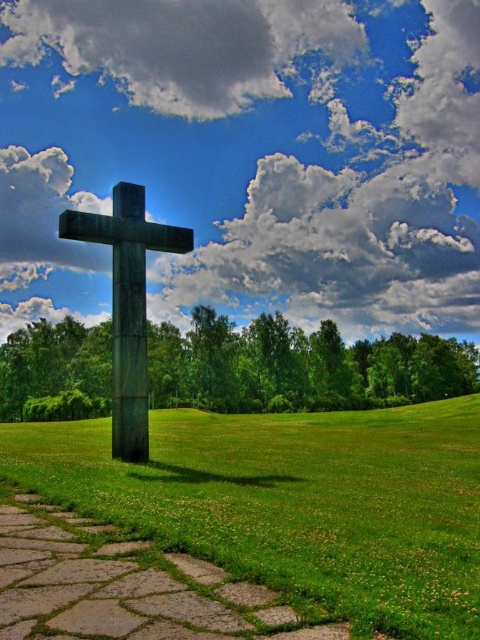
Question: Which point appears closest to the camera in this image?

Choices:
 (A) (130, 458)
 (B) (231, 106)

Answer: (A)

Question: Does cloudy sky at upper center appear on the right side of dark green stone cross at center?

Choices:
 (A) yes
 (B) no

Answer: (B)

Question: Estimate the real-world distances between objects in this image. Which object is closer to the green grass at center?

Choices:
 (A) dark green stone cross at center
 (B) white fluffy cloud at upper center
 (C) cloudy sky at upper center

Answer: (A)

Question: From the image, what is the correct spatial relationship of white fluffy cloud at upper center in relation to cloudy sky at upper center?

Choices:
 (A) right
 (B) left

Answer: (A)

Question: Does green grass at center have a lesser width compared to cloudy sky at upper center?

Choices:
 (A) no
 (B) yes

Answer: (B)

Question: Which of the following is the closest to the observer?

Choices:
 (A) (93, 216)
 (B) (452, 545)
 (C) (231, 202)

Answer: (B)